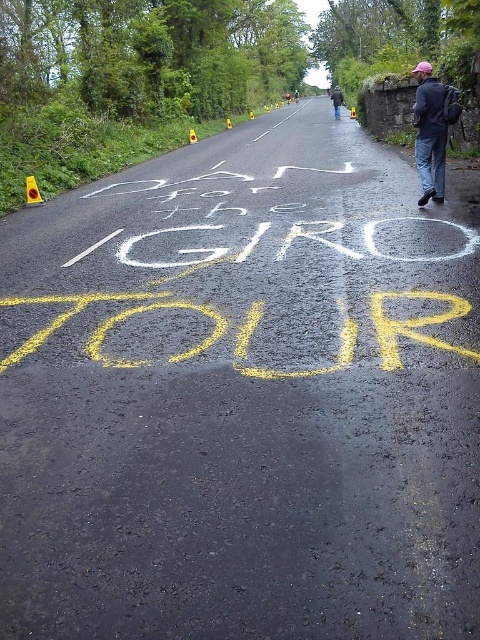
You are a photographer standing on the side of the road. You see a cyclist wearing a dark blue jacket at right and another wearing a black jacket at center. Which cyclist is closer to you?

The dark blue jacket at right is shorter than the black jacket at center, so the cyclist wearing the dark blue jacket at right is closer to you.

Looking at this image, you are a photographer standing at the side of the road capturing the scene. You want to ensure both the dark blue jacket at right and the black jacket at center are visible in your shot. Which jacket appears narrower in the photo?

The dark blue jacket at right appears narrower in the photo compared to the black jacket at center.